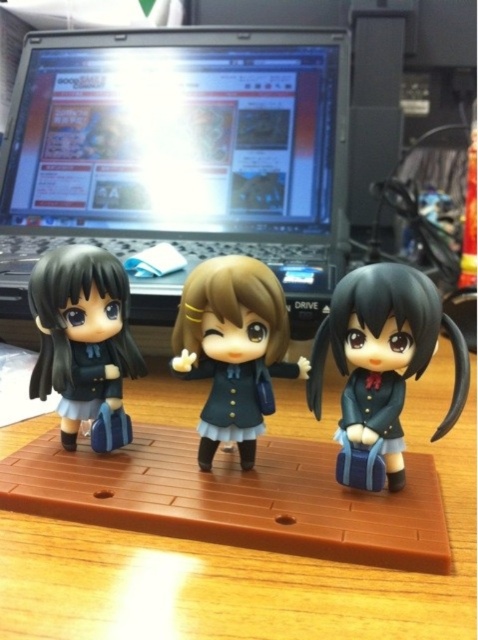
Question: Which object is the closest to the brown plastic table at center?

Choices:
 (A) matte black doll at right
 (B) matte green uniform at center

Answer: (B)

Question: Which of the following is the closest to the observer?

Choices:
 (A) (67, 369)
 (B) (359, 326)

Answer: (B)

Question: Which of the following is the closest to the observer?

Choices:
 (A) matte green uniform at center
 (B) brown plastic table at center
 (C) matte black doll at right

Answer: (B)

Question: Observing the image, what is the correct spatial positioning of brown plastic table at center in reference to matte black doll at left?

Choices:
 (A) below
 (B) above

Answer: (A)

Question: Does black glossy laptop at upper center appear on the right side of matte green uniform at center?

Choices:
 (A) no
 (B) yes

Answer: (A)

Question: In this image, where is black glossy laptop at upper center located relative to brown plastic table at center?

Choices:
 (A) right
 (B) left

Answer: (B)